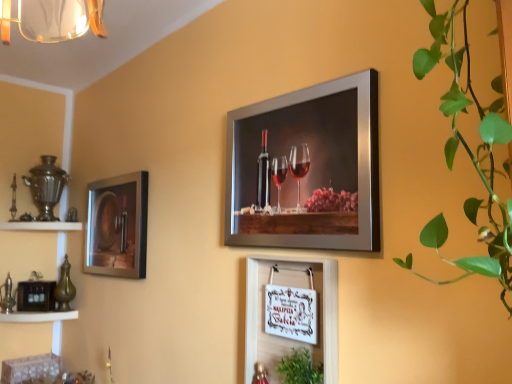
Question: Is white wood sign at center, which appears as the 2th picture frame when viewed from the left, wider than metallic silver wine bottle at left, which ranks as the 1th picture frame in back-to-front order?

Choices:
 (A) no
 (B) yes

Answer: (B)

Question: Is white wood sign at center, which appears as the 2th picture frame when viewed from the left, with metallic silver wine bottle at left, which appears as the 3th picture frame when viewed from the front?

Choices:
 (A) yes
 (B) no

Answer: (B)

Question: Is white wood sign at center, marked as the second picture frame in a right-to-left arrangement, aimed at metallic silver wine bottle at left, the third picture frame in the right-to-left sequence?

Choices:
 (A) no
 (B) yes

Answer: (A)

Question: Is white wood sign at center, marked as the second picture frame in a right-to-left arrangement, shorter than metallic silver wine bottle at left, the third picture frame in the right-to-left sequence?

Choices:
 (A) no
 (B) yes

Answer: (B)

Question: From a real-world perspective, is white wood sign at center, which appears as the second picture frame when viewed from the front, beneath metallic silver wine bottle at left, which ranks as the 1th picture frame in back-to-front order?

Choices:
 (A) no
 (B) yes

Answer: (B)

Question: Considering the relative positions of white wood sign at center, marked as the second picture frame in a right-to-left arrangement, and metallic silver wine bottle at left, the third picture frame in the right-to-left sequence, in the image provided, is white wood sign at center, marked as the second picture frame in a right-to-left arrangement, to the left of metallic silver wine bottle at left, the third picture frame in the right-to-left sequence, from the viewer's perspective?

Choices:
 (A) no
 (B) yes

Answer: (A)

Question: Does green leafy plant at lower center appear on the right side of green leafy plant at right?

Choices:
 (A) yes
 (B) no

Answer: (B)

Question: Is green leafy plant at lower center far away from green leafy plant at right?

Choices:
 (A) no
 (B) yes

Answer: (A)

Question: Is green leafy plant at lower center facing towards green leafy plant at right?

Choices:
 (A) yes
 (B) no

Answer: (B)

Question: Does green leafy plant at lower center have a larger size compared to green leafy plant at right?

Choices:
 (A) yes
 (B) no

Answer: (B)

Question: From the image's perspective, is green leafy plant at lower center below green leafy plant at right?

Choices:
 (A) no
 (B) yes

Answer: (B)

Question: From a real-world perspective, is green leafy plant at lower center physically above green leafy plant at right?

Choices:
 (A) no
 (B) yes

Answer: (A)

Question: Does metallic silver wine bottle at left, which appears as the 3th picture frame when viewed from the front, have a greater width compared to white wood sign at center, the 2th picture frame positioned from the back?

Choices:
 (A) yes
 (B) no

Answer: (B)